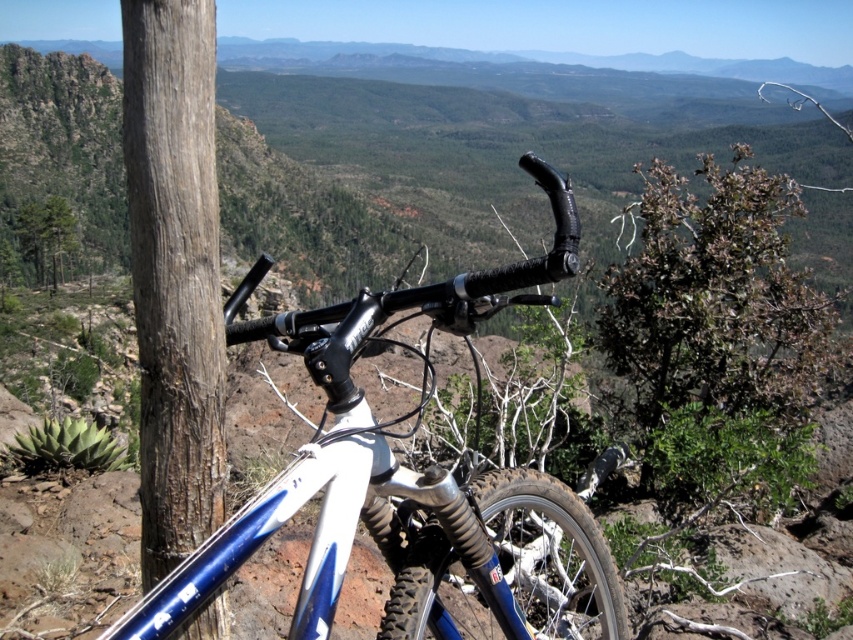
You are a hiker who wants to take a photo of the smooth brown wood at left and the blue matte bicycle handlebars at center. Which object should you focus on first if you want to capture both in the same frame without moving your camera?

The blue matte bicycle handlebars at center is taller than the smooth brown wood at left, so you should focus on the blue matte bicycle handlebars at center first to ensure both objects are in the frame.

You are a hiker who wants to place a 3.5 meter long tent between the blue matte bicycle handlebars at center and the smooth brown wood at left. Can the tent fit in the space between them?

The distance between the blue matte bicycle handlebars at center and the smooth brown wood at left is 3.45 meters, so the tent cannot fit as it is slightly shorter than the tent length.

You are a hiker who wants to take a photo of the blue matte bicycle handlebars at center and the smooth brown wood at left. Which object should you focus on first if you want to capture both in the same frame without moving your camera?

The blue matte bicycle handlebars at center is larger in size compared to the smooth brown wood at left, so you should focus on the blue matte bicycle handlebars at center first to ensure it fits properly in the frame.